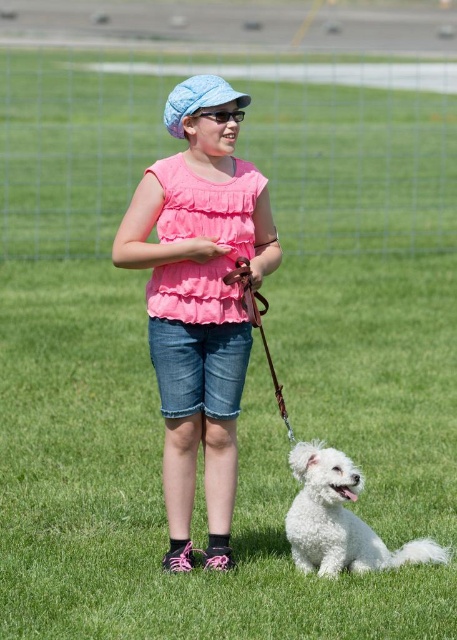
Does pink cotton shirt at center have a greater width compared to matte black goggles at center?

Yes.

Which is behind, point (221, 387) or point (235, 115)?

Positioned behind is point (221, 387).

What are the coordinates of `pink cotton shirt at center` in the screenshot? It's located at (198, 301).

Does white fluffy dog at lower right have a larger size compared to brown leather leash at center?

Correct, white fluffy dog at lower right is larger in size than brown leather leash at center.

Is point (445, 554) positioned in front of point (261, 312)?

That is False.

Locate an element on the screen. Image resolution: width=457 pixels, height=640 pixels. white fluffy dog at lower right is located at coordinates (340, 518).

Which is above, brown leather leash at center or matte black goggles at center?

matte black goggles at center is higher up.

Is point (285, 404) positioned in front of point (222, 108)?

No, (285, 404) is behind (222, 108).

The width and height of the screenshot is (457, 640). What do you see at coordinates (258, 324) in the screenshot?
I see `brown leather leash at center` at bounding box center [258, 324].

The image size is (457, 640). Identify the location of brown leather leash at center. (258, 324).